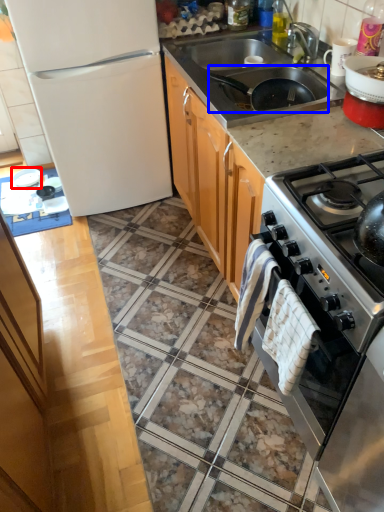
Question: Which object is closer to the camera taking this photo, appliance (highlighted by a red box) or frying pan (highlighted by a blue box)?

Choices:
 (A) appliance
 (B) frying pan

Answer: (B)